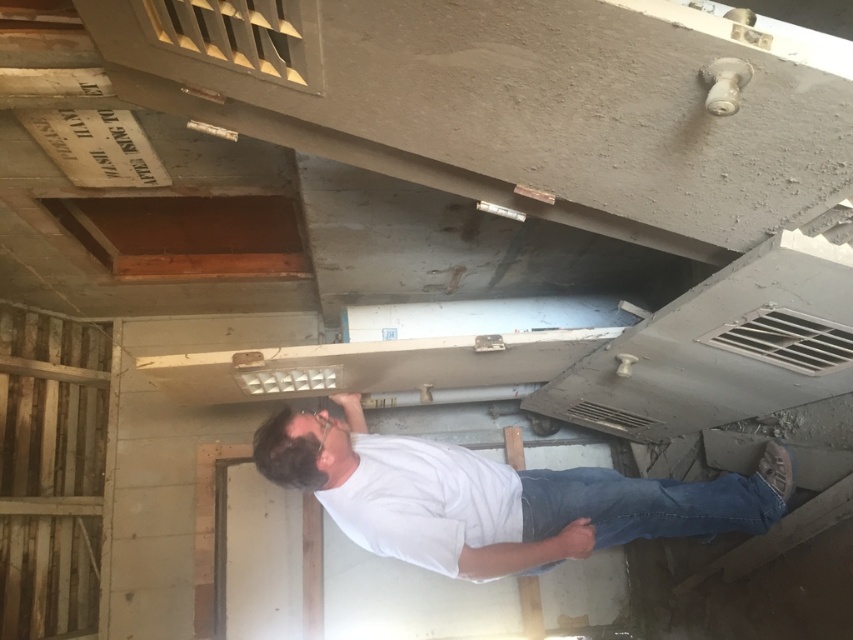
In the scene shown: You are an interior designer assessing the renovation progress. You notice the white matte shirt at center and the blue denim jeans at lower center in the image. Which object takes up more visual space in the scene?

The white matte shirt at center takes up more visual space in the scene as it is bigger than the blue denim jeans at lower center.